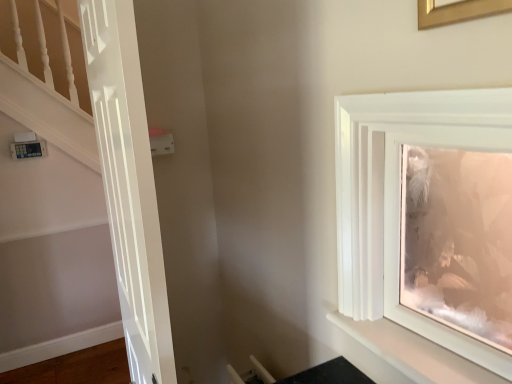
Locate an element on the screen. The image size is (512, 384). blank space above white glossy frame at upper right (from a real-world perspective) is located at coordinates click(430, 91).